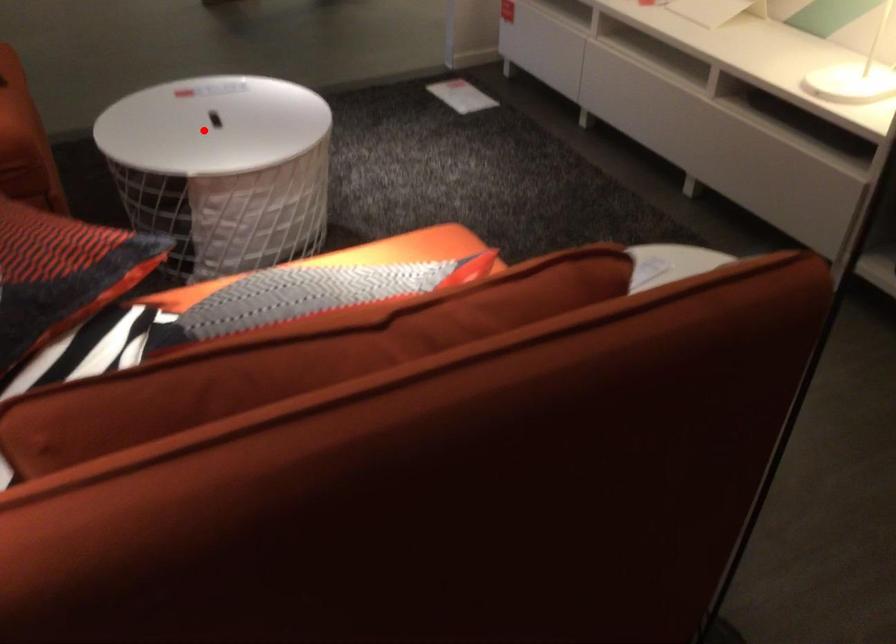
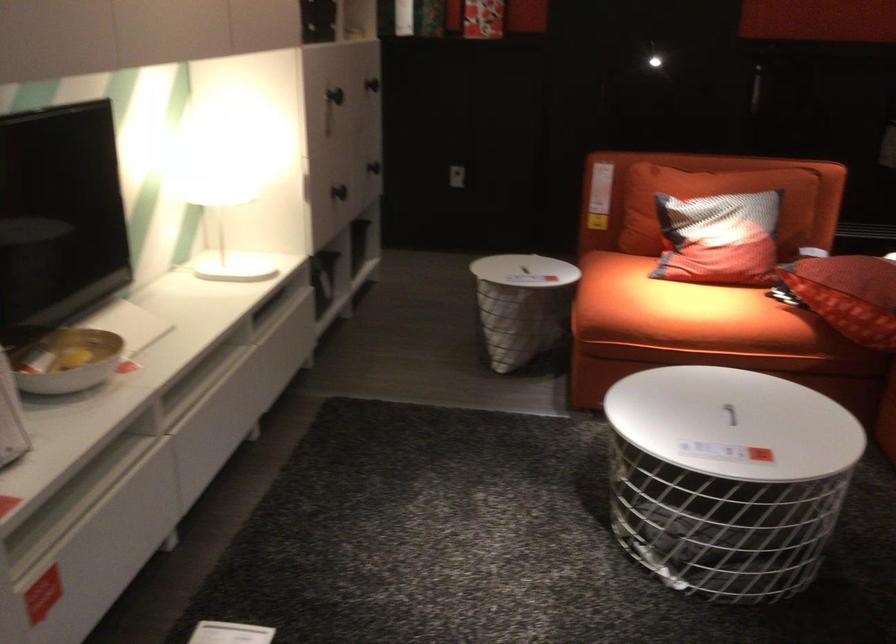
Where in the second image is the point corresponding to the highlighted location from the first image?

(729, 413)